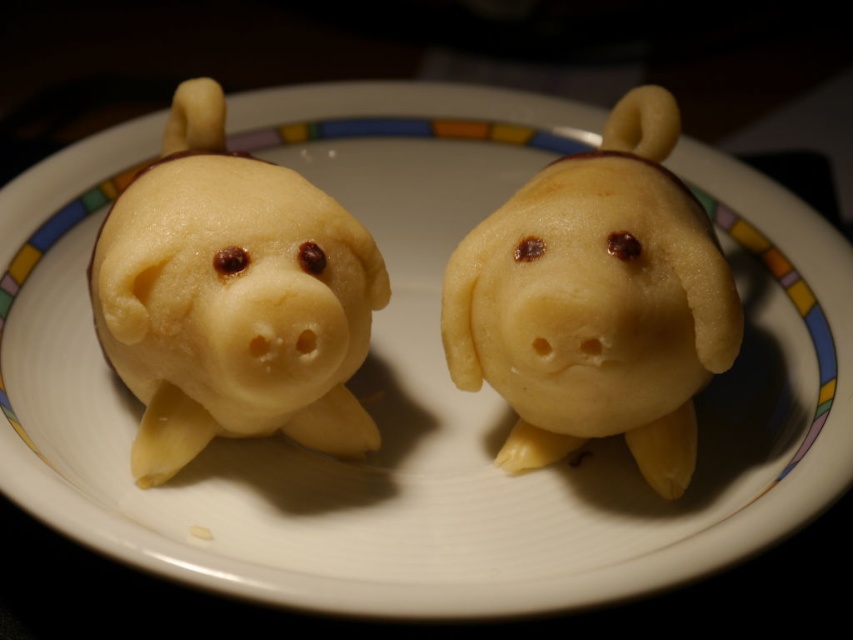
You are a food critic examining the plate with the pig pastry. The plate has a rim with colored stripes. Can you determine the color of the stripe directly below the matte yellow pastry at left?

The matte yellow pastry at left is located at point [231,298], so the stripe directly below it would be yellow since the pastry is positioned over the yellow section of the plate rim.

You are a food critic evaluating the presentation of this dish. You notice two pig shaped pastries on the plate. The matte yellow pastry at left and the yellow matte piglet at center. Which one has a greater width?

The matte yellow pastry at left has a greater width than the yellow matte piglet at center.

Looking at the plate with the pig shaped food items, which one between the matte yellow pastry at left and the yellow matte piglet at center is taller?

The yellow matte piglet at center is taller than the matte yellow pastry at left.